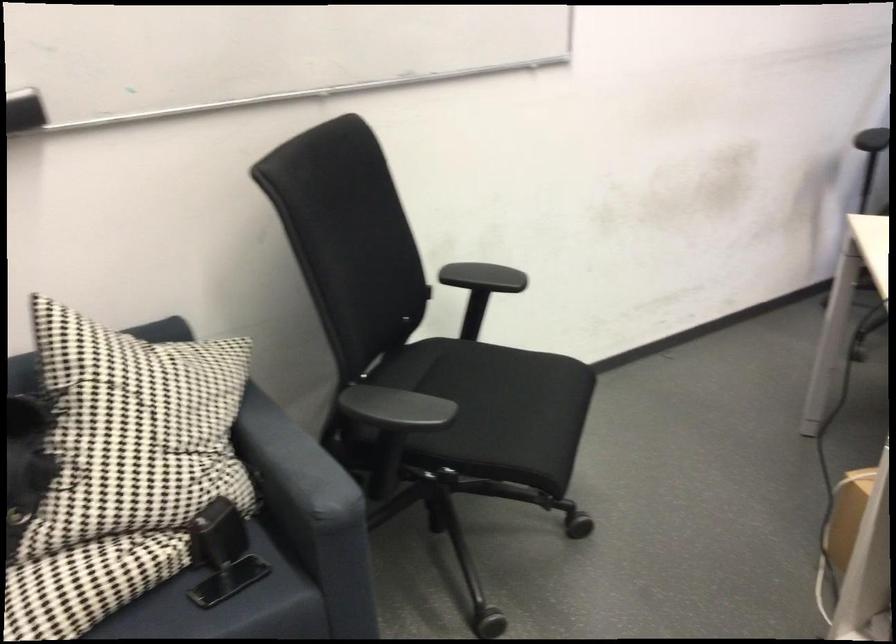
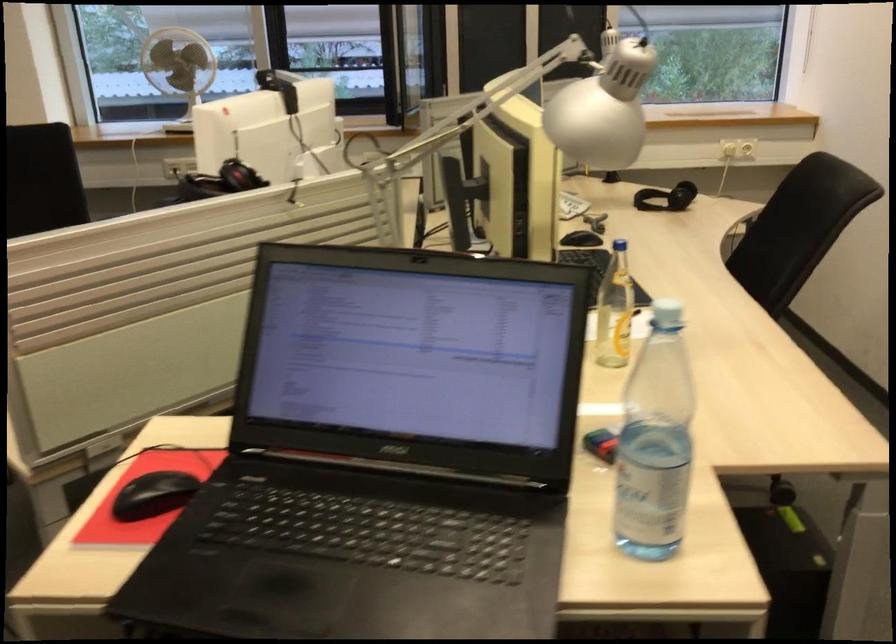
Question: The images are taken continuously from a first-person perspective. In which direction is your viewpoint rotating?

Choices:
 (A) Left
 (B) Right
 (C) Up
 (D) Down

Answer: (B)